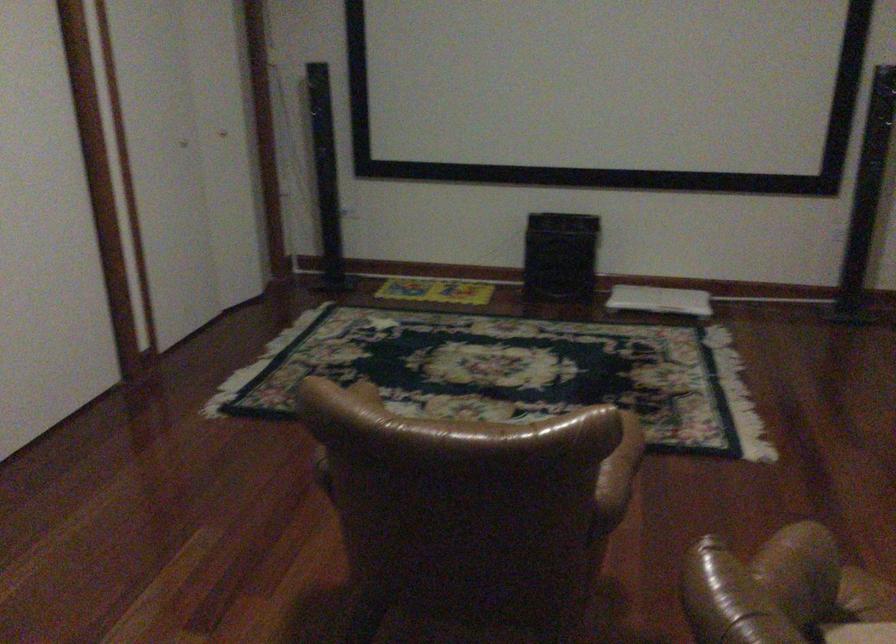
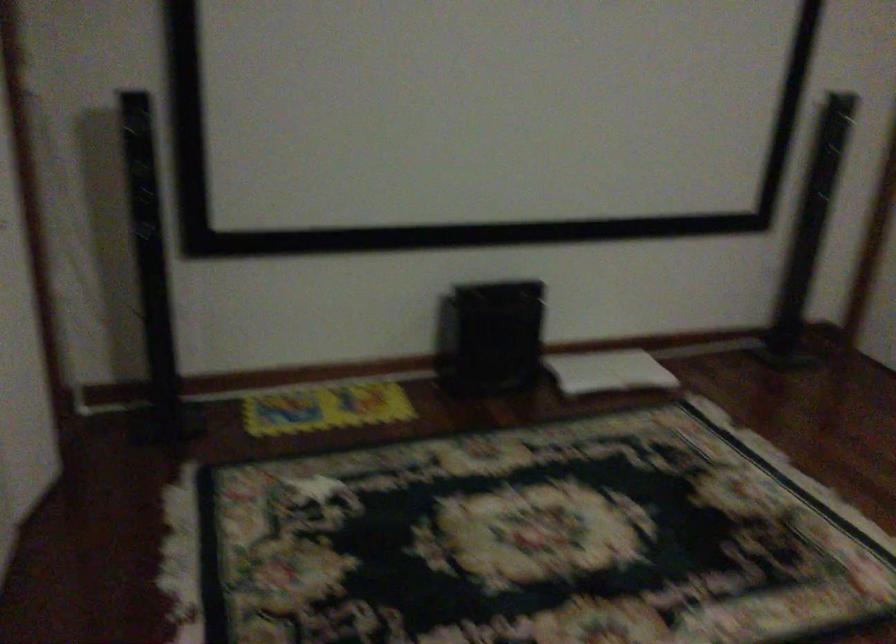
In a continuous first-person perspective shot, in which direction is the camera moving?

The cameraman moved toward left, forward.